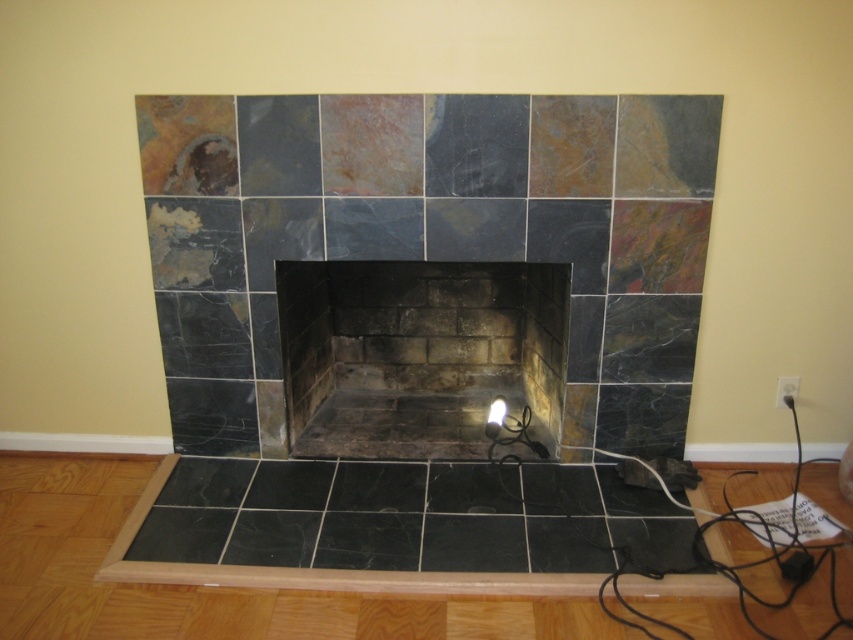
Question: Considering the relative positions of black slate fireplace at center and black plastic plug at lower right in the image provided, where is black slate fireplace at center located with respect to black plastic plug at lower right?

Choices:
 (A) right
 (B) left

Answer: (B)

Question: Does black plastic plug at lower right have a larger size compared to white plastic electric outlet at lower right?

Choices:
 (A) no
 (B) yes

Answer: (B)

Question: Which is nearer to the white glossy lampshade at center?

Choices:
 (A) black plastic plug at lower right
 (B) white plastic electric outlet at lower right

Answer: (B)

Question: Among these objects, which one is nearest to the camera?

Choices:
 (A) black slate fireplace at center
 (B) black plastic plug at lower right
 (C) white glossy lampshade at center

Answer: (B)

Question: Is black plastic plug at lower right bigger than white plastic electric outlet at lower right?

Choices:
 (A) yes
 (B) no

Answer: (A)

Question: Which of the following is the closest to the observer?

Choices:
 (A) black slate fireplace at center
 (B) white glossy lampshade at center

Answer: (A)